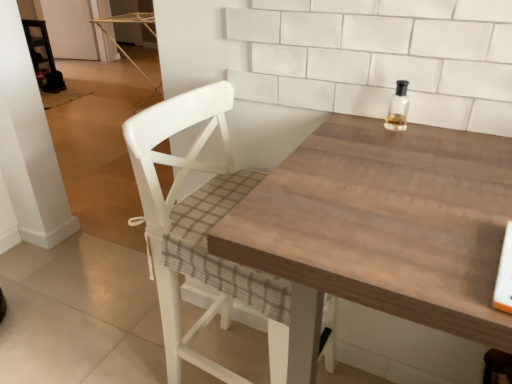
Question: Is white wood chair at center aimed at clear glass bottle at upper right?

Choices:
 (A) yes
 (B) no

Answer: (A)

Question: Is clear glass bottle at upper right inside white wood chair at center?

Choices:
 (A) no
 (B) yes

Answer: (A)

Question: Considering the relative sizes of white wood chair at center and clear glass bottle at upper right in the image provided, is white wood chair at center bigger than clear glass bottle at upper right?

Choices:
 (A) no
 (B) yes

Answer: (B)

Question: From the image's perspective, is white wood chair at center above clear glass bottle at upper right?

Choices:
 (A) yes
 (B) no

Answer: (B)

Question: Does white wood chair at center have a lesser width compared to clear glass bottle at upper right?

Choices:
 (A) no
 (B) yes

Answer: (A)

Question: Would you say white wood chair at center is outside clear glass bottle at upper right?

Choices:
 (A) yes
 (B) no

Answer: (A)

Question: Is wooden table at center not within white wood chair at center?

Choices:
 (A) no
 (B) yes

Answer: (B)

Question: From the image's perspective, is wooden table at center below white wood chair at center?

Choices:
 (A) no
 (B) yes

Answer: (B)

Question: Is wooden table at center smaller than white wood chair at center?

Choices:
 (A) yes
 (B) no

Answer: (B)

Question: Is wooden table at center beside white wood chair at center?

Choices:
 (A) no
 (B) yes

Answer: (A)

Question: Considering the relative sizes of wooden table at center and white wood chair at center in the image provided, is wooden table at center wider than white wood chair at center?

Choices:
 (A) yes
 (B) no

Answer: (A)

Question: Does wooden table at center have a lesser height compared to white wood chair at center?

Choices:
 (A) no
 (B) yes

Answer: (B)

Question: Would you say clear glass bottle at upper right is outside white wood chair at center?

Choices:
 (A) yes
 (B) no

Answer: (A)